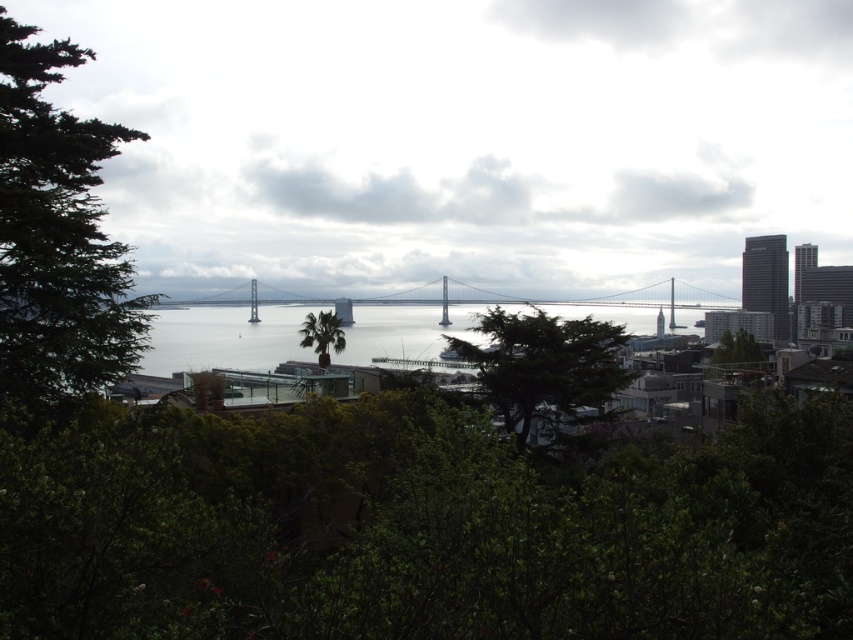
You are a city planner reviewing this area. You need to determine if the green leafy palm tree at center will be visible from the transparent glass bridge at center. Based on the scene description, can you confirm if the palm tree is in front of or behind the bridge?

The green leafy palm tree at center is behind transparent glass bridge at center, so it will be visible from the bridge as it is positioned behind the transparent structure.

You are standing at the base of the suspension bridge and want to take a photo of both the point at coordinates point (635, 76) and point (311, 324). Which point is closer to your camera when you take the photo?

Point (311, 324) is closer to the camera because it is less further away than point (635, 76), which is further away from the camera.